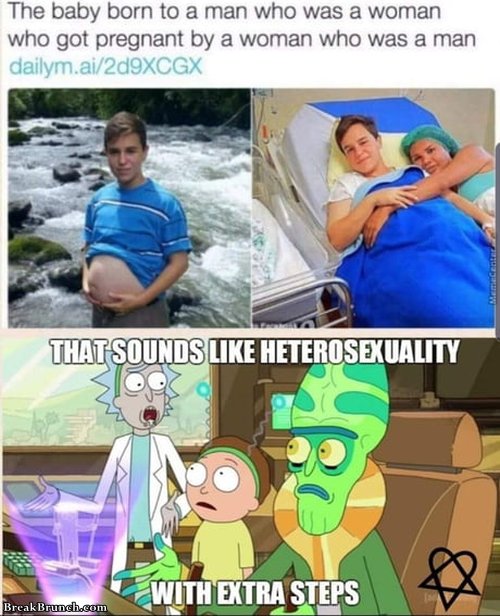
Identify the location of bed. (307, 148).